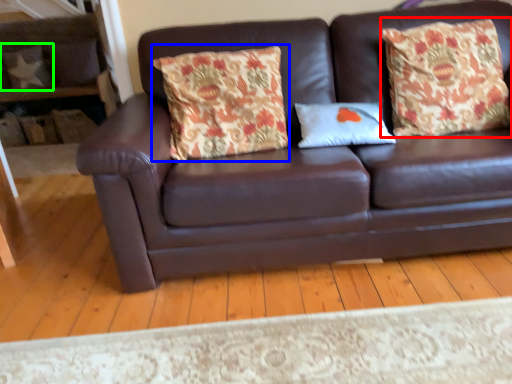
Question: Which is nearer to the throw pillow (highlighted by a red box)? throw pillow (highlighted by a blue box) or pillow (highlighted by a green box).

Choices:
 (A) throw pillow
 (B) pillow

Answer: (A)